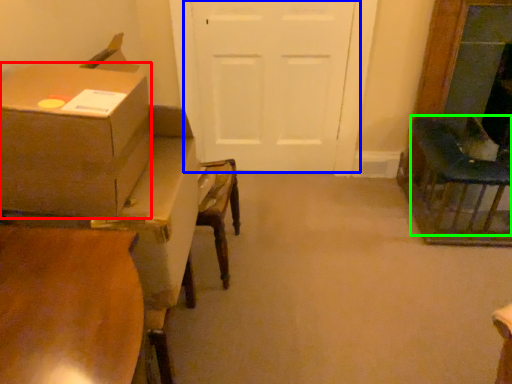
Question: Which object is positioned closest to box (highlighted by a red box)? Select from door (highlighted by a blue box) and chair (highlighted by a green box).

Choices:
 (A) door
 (B) chair

Answer: (A)